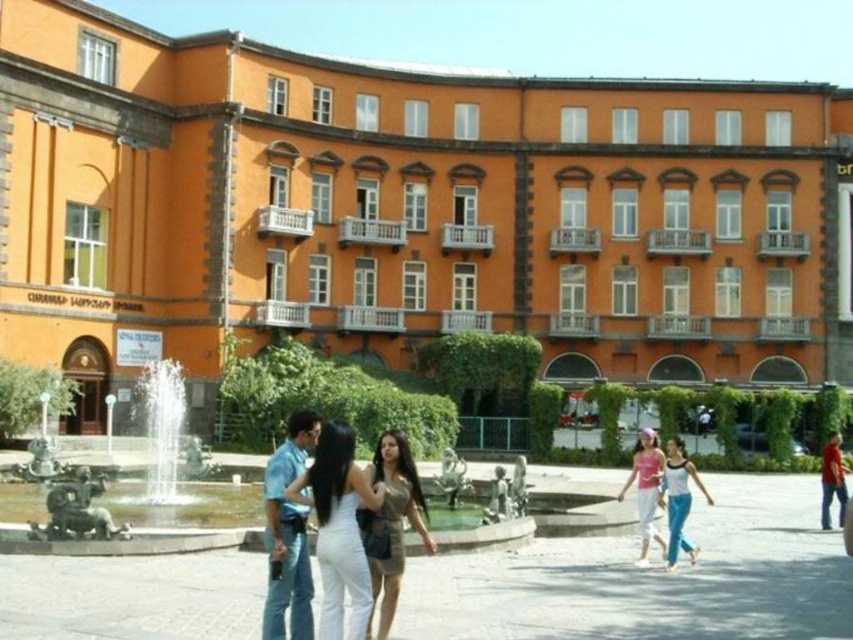
Is orange matte building at upper center wider than brown leather dress at center?

Yes.

Does orange matte building at upper center come in front of brown leather dress at center?

No.

Between point (747, 113) and point (412, 474), which one is positioned in front?

Point (412, 474) is more forward.

I want to click on orange matte building at upper center, so click(x=407, y=211).

Who is higher up, white cotton dress at center or white cotton tank top at center?

Positioned higher is white cotton dress at center.

Based on the photo, who is more forward, (308, 410) or (682, 451)?

Point (682, 451)

What are the coordinates of `white cotton dress at center` in the screenshot? It's located at (321, 522).

Who is higher up, white cotton tank top at center or pink fabric dress at center?

white cotton tank top at center is above.

Is white cotton tank top at center bigger than pink fabric dress at center?

Actually, white cotton tank top at center might be smaller than pink fabric dress at center.

Does point (666, 560) come behind point (643, 552)?

No, it is not.

This screenshot has height=640, width=853. Identify the location of white cotton tank top at center. (677, 499).